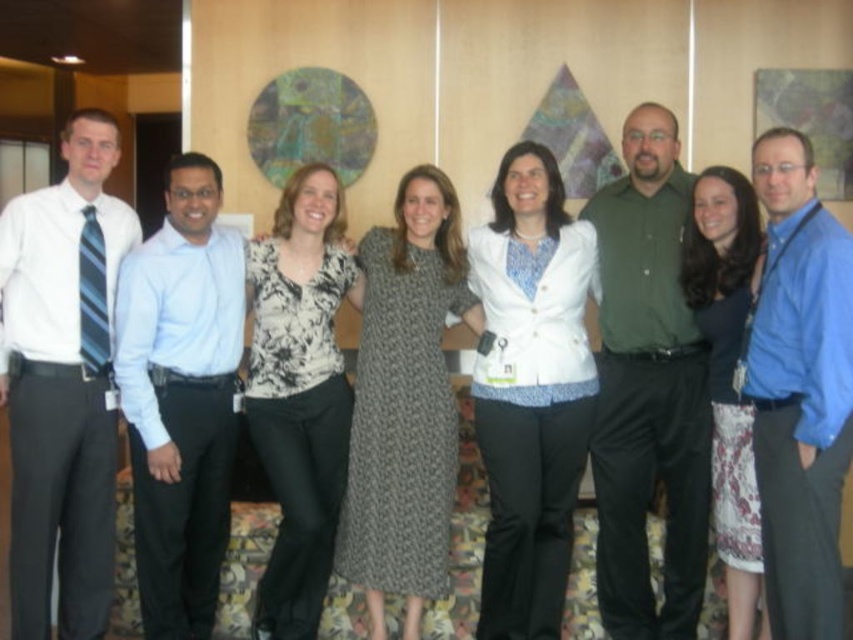
You are standing in the group photo and want to move from your current position to the location of the person at point [428,272]. Is the path clear between your current position at point [480,420] and the target point?

Yes, the path between point [480,420] and point [428,272] is clear because point [480,420] is in front of point [428,272], indicating there is no obstruction between them.

You are a photographer trying to focus on the white textured blazer at center. What are the coordinates where you should aim your camera?

You should aim your camera at coordinates point (531, 390) to focus on the white textured blazer at center.

You are a photographer trying to adjust the lighting for a group photo. You notice the matte white shirt at left and the knit fabric dress at center. Which of these two items might require more careful lighting to avoid overexposure?

The matte white shirt at left has a smaller size compared to the knit fabric dress at center, so the smaller matte white shirt at left might require more careful lighting to avoid overexposure because smaller white objects can reflect more light and may overexposure faster.